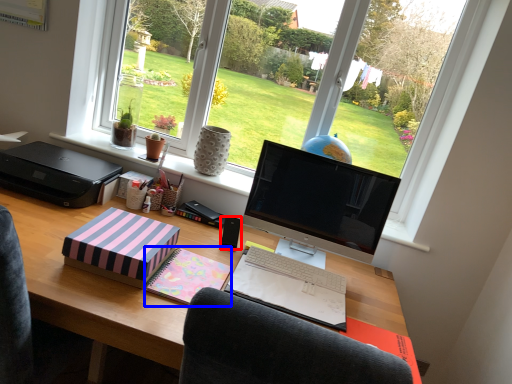
Question: Which of the following is the farthest to the observer, speaker (highlighted by a red box) or paperback book (highlighted by a blue box)?

Choices:
 (A) speaker
 (B) paperback book

Answer: (A)